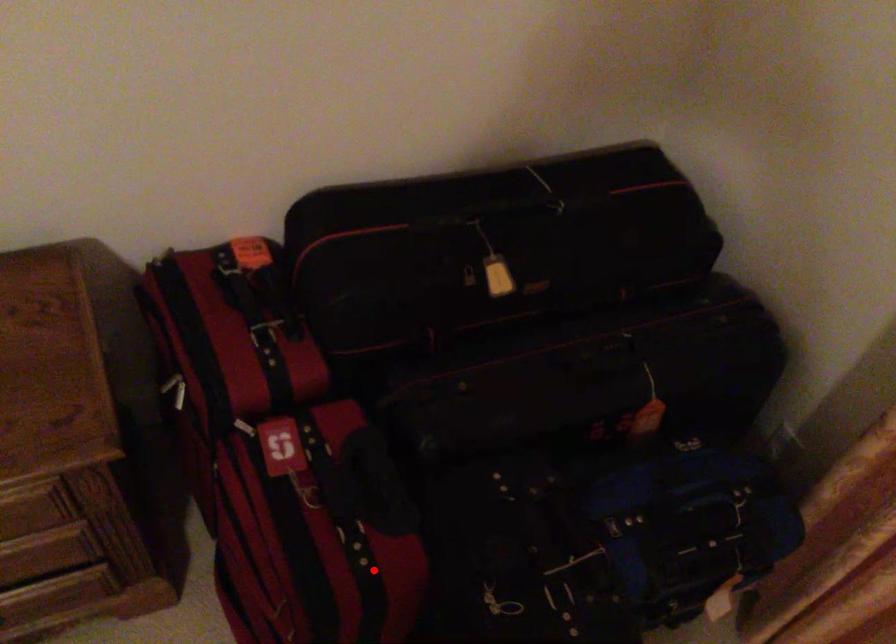
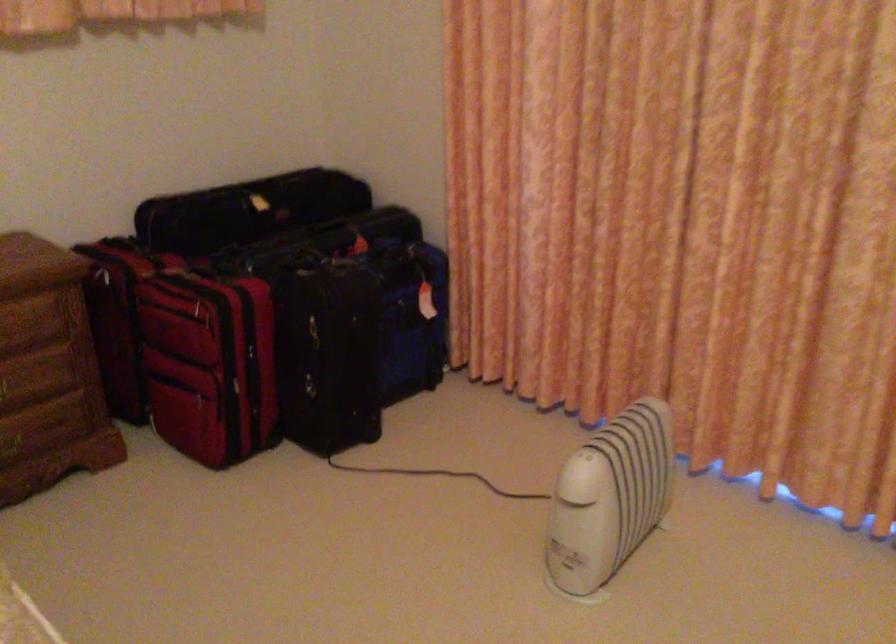
Locate, in the second image, the point that corresponds to the highlighted location in the first image.

(243, 292)